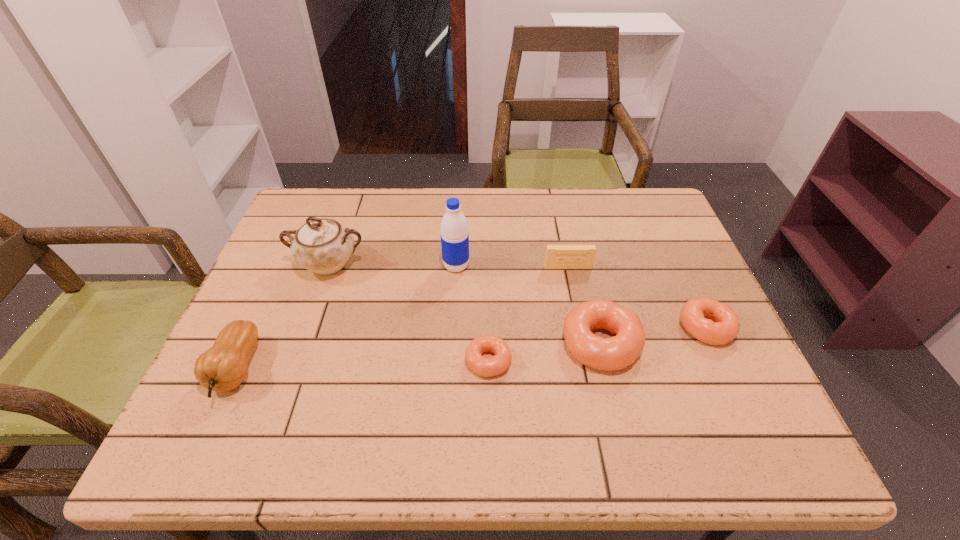
In the image, there is a desktop. At what (x,y) coordinates should I click in order to perform the action: click on vacant area at the far edge. Please return your answer as a coordinate pair (x, y). Looking at the image, I should click on (431, 211).

In the image, there is a desktop. Where is `blank space at the near edge`? The image size is (960, 540). blank space at the near edge is located at coordinates (489, 382).

You are a GUI agent. You are given a task and a screenshot of the screen. Output one action in this format:
    pyautogui.click(x=<x>, y=<y>)
    Task: Click on the free point at the left edge
    The width and height of the screenshot is (960, 540).
    Given the screenshot: What is the action you would take?
    pyautogui.click(x=291, y=254)

Locate an element on the screen. free space at the right edge of the desktop is located at coordinates pos(664,239).

At what (x,y) coordinates should I click in order to perform the action: click on free space at the far right corner of the desktop. Please return your answer as a coordinate pair (x, y). Looking at the image, I should click on (650, 204).

Find the location of `blank space at the near right corner of the desktop`. blank space at the near right corner of the desktop is located at coordinates (721, 384).

This screenshot has height=540, width=960. What are the coordinates of `vacant area that lies between the videotape and the tallest object` in the screenshot? It's located at (512, 267).

Locate an element on the screen. The image size is (960, 540). unoccupied area between the second shortest doughnut and the water bottle is located at coordinates (581, 296).

Where is `vacant area that lies between the shortest doughnut and the tallest object`? The width and height of the screenshot is (960, 540). vacant area that lies between the shortest doughnut and the tallest object is located at coordinates (472, 313).

You are a GUI agent. You are given a task and a screenshot of the screen. Output one action in this format:
    pyautogui.click(x=<x>, y=<y>)
    Task: Click on the vacant area that lies between the third tallest object and the videotape
    Image resolution: width=960 pixels, height=540 pixels.
    Given the screenshot: What is the action you would take?
    pyautogui.click(x=402, y=318)